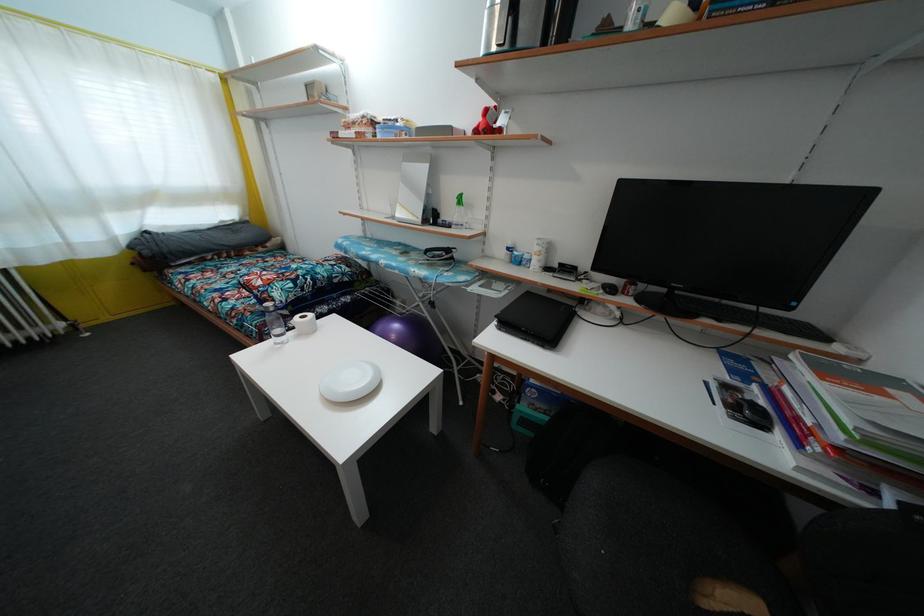
Find the location of a particular element. This screenshot has width=924, height=616. black iron handle is located at coordinates (251, 293).